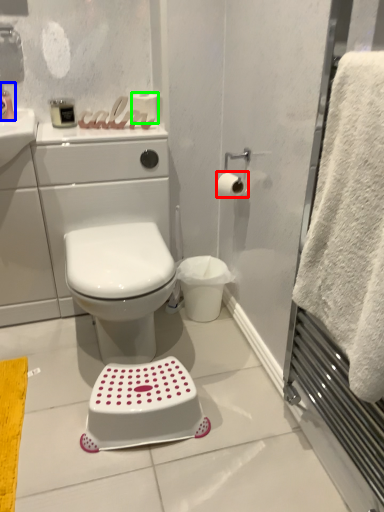
Question: Estimate the real-world distances between objects in this image. Which object is farther from toilet paper (highlighted by a red box), toiletry (highlighted by a blue box) or toilet paper (highlighted by a green box)?

Choices:
 (A) toiletry
 (B) toilet paper

Answer: (A)